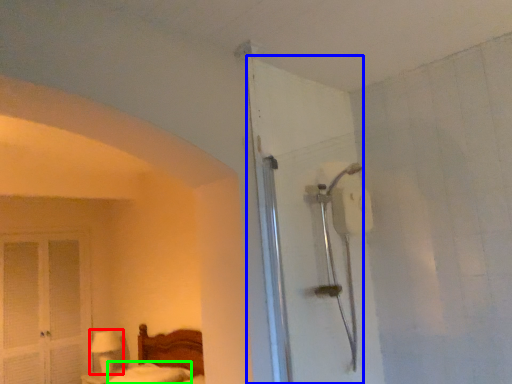
Question: Based on their relative distances, which object is nearer to table lamp (highlighted by a red box)? Choose from door (highlighted by a blue box) and mattress (highlighted by a green box).

Choices:
 (A) door
 (B) mattress

Answer: (B)